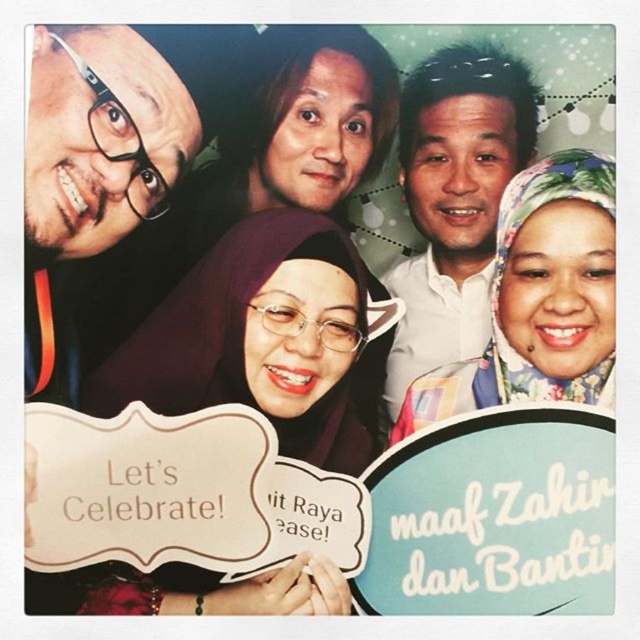
You are a photographer adjusting the camera settings for the group photo. The matte black glasses at left are positioned at coordinates point (106, 156). If the camera focuses on the central subject, will the matte black glasses at left be in focus?

The point (106, 156) corresponds to the matte black glasses at left. Since the camera focuses on the central subject, the matte black glasses at left may not be in focus as they are positioned away from the central focus point.

You are a photographer adjusting the lighting for a photo shoot. You notice the matte black glasses at left and the floral fabric hijab at upper right in the frame. Which object should you adjust the lighting on first to ensure it doesn not get lost in the background?

The matte black glasses at left should be adjusted first because it is in front of the floral fabric hijab at upper right and might cast shadows or require more light to stand out.